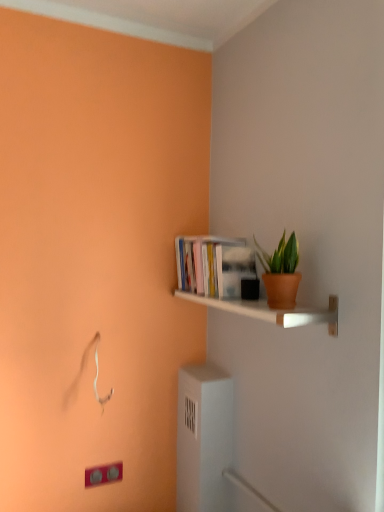
The image size is (384, 512). I want to click on terracotta clay pot at upper right, so click(x=280, y=272).

This screenshot has height=512, width=384. What do you see at coordinates (280, 272) in the screenshot? I see `terracotta clay pot at upper right` at bounding box center [280, 272].

What do you see at coordinates (272, 311) in the screenshot? This screenshot has width=384, height=512. I see `white glossy shelf at upper right` at bounding box center [272, 311].

The width and height of the screenshot is (384, 512). Find the location of `terracotta clay pot at upper right`. terracotta clay pot at upper right is located at coordinates (280, 272).

Does point (202, 264) come farther from viewer compared to point (115, 481)?

That is False.

Would you say hardcover books at upper right contains matte white light switch at lower left?

That's incorrect, matte white light switch at lower left is not inside hardcover books at upper right.

What's the angular difference between hardcover books at upper right and matte white light switch at lower left's facing directions?

The angular difference between hardcover books at upper right and matte white light switch at lower left is 89 degrees.

Between hardcover books at upper right and matte white light switch at lower left, which one has smaller size?

With smaller size is matte white light switch at lower left.

Are white glossy shelf at upper right and matte white light switch at lower left located far from each other?

No, white glossy shelf at upper right is in close proximity to matte white light switch at lower left.

Looking at this image, is white glossy shelf at upper right inside or outside of matte white light switch at lower left?

The correct answer is: outside.

From a real-world perspective, which is physically below, white glossy shelf at upper right or matte white light switch at lower left?

matte white light switch at lower left is physically lower.

Are terracotta clay pot at upper right and white glossy shelf at upper right far apart?

Actually, terracotta clay pot at upper right and white glossy shelf at upper right are a little close together.

Between point (294, 298) and point (277, 320), which one is positioned behind?

The point (294, 298) is more distant.

From the picture: Considering the relative sizes of terracotta clay pot at upper right and white glossy shelf at upper right in the image provided, is terracotta clay pot at upper right thinner than white glossy shelf at upper right?

Correct, the width of terracotta clay pot at upper right is less than that of white glossy shelf at upper right.

Which object is positioned more to the left, terracotta clay pot at upper right or white glossy shelf at upper right?

white glossy shelf at upper right is more to the left.

From a real-world perspective, which object stands above the other?

terracotta clay pot at upper right, from a real-world perspective.

Which object is closer to the camera taking this photo, terracotta clay pot at upper right or matte white light switch at lower left?

terracotta clay pot at upper right is in front.

The image size is (384, 512). I want to click on houseplant that is above the matte white light switch at lower left (from the image's perspective), so click(x=280, y=272).

Is point (281, 303) farther from camera compared to point (115, 467)?

No.

Considering the positions of objects terracotta clay pot at upper right and hardcover books at upper right in the image provided, who is more to the left, terracotta clay pot at upper right or hardcover books at upper right?

From the viewer's perspective, hardcover books at upper right appears more on the left side.

Which is less distant, (257, 256) or (225, 276)?

Positioned in front is point (225, 276).

From the image's perspective, which object appears higher, terracotta clay pot at upper right or hardcover books at upper right?

hardcover books at upper right appears higher in the image.

Does terracotta clay pot at upper right turn towards hardcover books at upper right?

No.

I want to click on houseplant lying in front of the matte white light switch at lower left, so click(280, 272).

From the image's perspective, would you say matte white light switch at lower left is shown under terracotta clay pot at upper right?

Yes, from the image's perspective, matte white light switch at lower left is below terracotta clay pot at upper right.

From a real-world perspective, is matte white light switch at lower left beneath terracotta clay pot at upper right?

Yes, from a real-world perspective, matte white light switch at lower left is below terracotta clay pot at upper right.

Which is further, (107, 479) or (267, 256)?

The point (107, 479) is farther.

Between point (312, 311) and point (210, 263), which one is positioned behind?

Point (210, 263)

Which of these two, white glossy shelf at upper right or hardcover books at upper right, is thinner?

hardcover books at upper right.

From a real-world perspective, is white glossy shelf at upper right physically located above or below hardcover books at upper right?

In terms of real-world spatial position, white glossy shelf at upper right is below hardcover books at upper right.

From the image's perspective, does white glossy shelf at upper right appear lower than hardcover books at upper right?

Yes, from the image's perspective, white glossy shelf at upper right is beneath hardcover books at upper right.

Where is `light switch lying behind the hardcover books at upper right`? Image resolution: width=384 pixels, height=512 pixels. light switch lying behind the hardcover books at upper right is located at coordinates (103, 474).

This screenshot has width=384, height=512. I want to click on light switch below the white glossy shelf at upper right (from a real-world perspective), so click(103, 474).

Which object lies further to the anchor point matte white light switch at lower left, hardcover books at upper right or white glossy shelf at upper right?

hardcover books at upper right lies further to matte white light switch at lower left than the other object.

From the image, which object appears to be farther from white glossy shelf at upper right, hardcover books at upper right or terracotta clay pot at upper right?

The object further to white glossy shelf at upper right is hardcover books at upper right.

Which object lies further to the anchor point matte white light switch at lower left, terracotta clay pot at upper right or white glossy shelf at upper right?

The object further to matte white light switch at lower left is terracotta clay pot at upper right.

Consider the image. Considering their positions, is terracotta clay pot at upper right positioned closer to white glossy shelf at upper right than hardcover books at upper right?

terracotta clay pot at upper right lies closer to white glossy shelf at upper right than the other object.

When comparing their distances from matte white light switch at lower left, does white glossy shelf at upper right or terracotta clay pot at upper right seem closer?

Among the two, white glossy shelf at upper right is located nearer to matte white light switch at lower left.

Based on their spatial positions, is hardcover books at upper right or matte white light switch at lower left closer to terracotta clay pot at upper right?

hardcover books at upper right.

Considering their positions, is matte white light switch at lower left positioned further to hardcover books at upper right than terracotta clay pot at upper right?

Based on the image, matte white light switch at lower left appears to be further to hardcover books at upper right.

Based on their spatial positions, is matte white light switch at lower left or white glossy shelf at upper right further from terracotta clay pot at upper right?

Based on the image, matte white light switch at lower left appears to be further to terracotta clay pot at upper right.

The image size is (384, 512). In order to click on houseplant between hardcover books at upper right and matte white light switch at lower left vertically in this screenshot , I will do `click(280, 272)`.

Where is `shelf between terracotta clay pot at upper right and matte white light switch at lower left from top to bottom`? The image size is (384, 512). shelf between terracotta clay pot at upper right and matte white light switch at lower left from top to bottom is located at coordinates (272, 311).

Where is `shelf between hardcover books at upper right and matte white light switch at lower left from top to bottom`? This screenshot has width=384, height=512. shelf between hardcover books at upper right and matte white light switch at lower left from top to bottom is located at coordinates (272, 311).

I want to click on houseplant between white glossy shelf at upper right and hardcover books at upper right along the z-axis, so click(x=280, y=272).